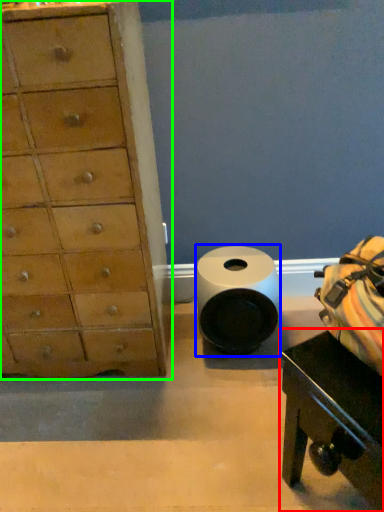
Question: Which is nearer to the table (highlighted by a red box)? toilet paper (highlighted by a blue box) or chest of drawers (highlighted by a green box).

Choices:
 (A) toilet paper
 (B) chest of drawers

Answer: (A)